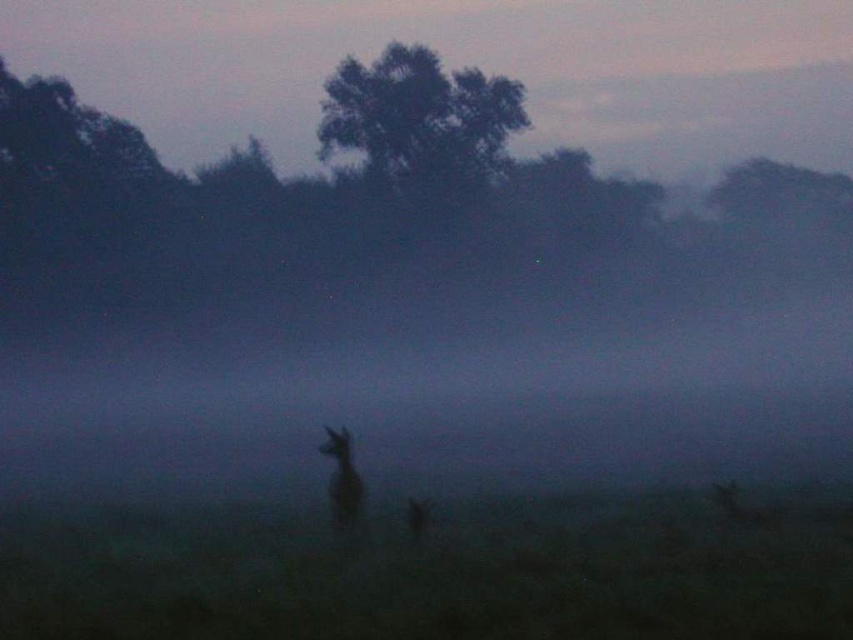
Question: Among these points, which one is nearest to the camera?

Choices:
 (A) [x=346, y=508]
 (B) [x=380, y=141]

Answer: (A)

Question: Can you confirm if green leafy tree at upper center is positioned above fuzzy brown deer at center?

Choices:
 (A) yes
 (B) no

Answer: (A)

Question: Which of the following is the closest to the observer?

Choices:
 (A) (344, 442)
 (B) (387, 156)

Answer: (A)

Question: Considering the relative positions of green leafy tree at upper center and fuzzy brown deer at center in the image provided, where is green leafy tree at upper center located with respect to fuzzy brown deer at center?

Choices:
 (A) left
 (B) right

Answer: (A)

Question: Is green leafy tree at upper center smaller than fuzzy brown deer at center?

Choices:
 (A) no
 (B) yes

Answer: (A)